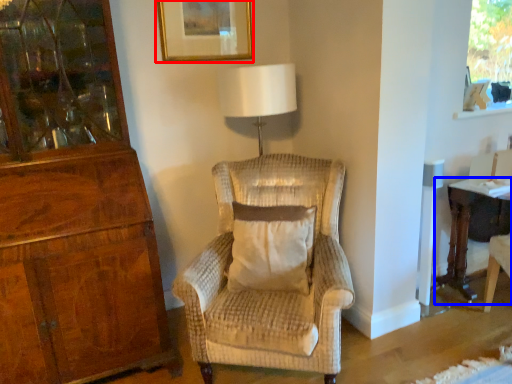
Question: Which point is further to the camera, picture frame (highlighted by a red box) or desk (highlighted by a blue box)?

Choices:
 (A) picture frame
 (B) desk

Answer: (A)